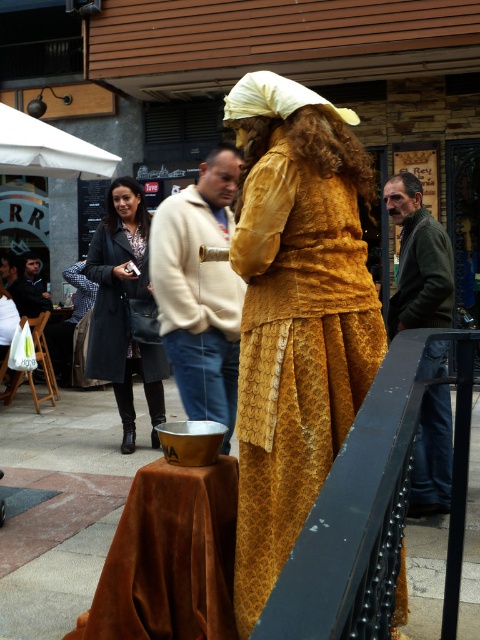
You are trying to move a small potted plant from the dark green jacket at right to the black metal railing at center. Can you place the plant on the railing without it falling off?

The black metal railing at center might be wider than dark green jacket at right, so it is possible the railing can hold the plant without it falling off, but there is uncertainty due to the comparative width.

You are a photographer trying to capture the best angle of the scene. You notice two points marked in the image. Which of the two points, point (267,342) or point (425,429), is closer to your camera lens?

Point (267,342) is closer to the camera than point (425,429).